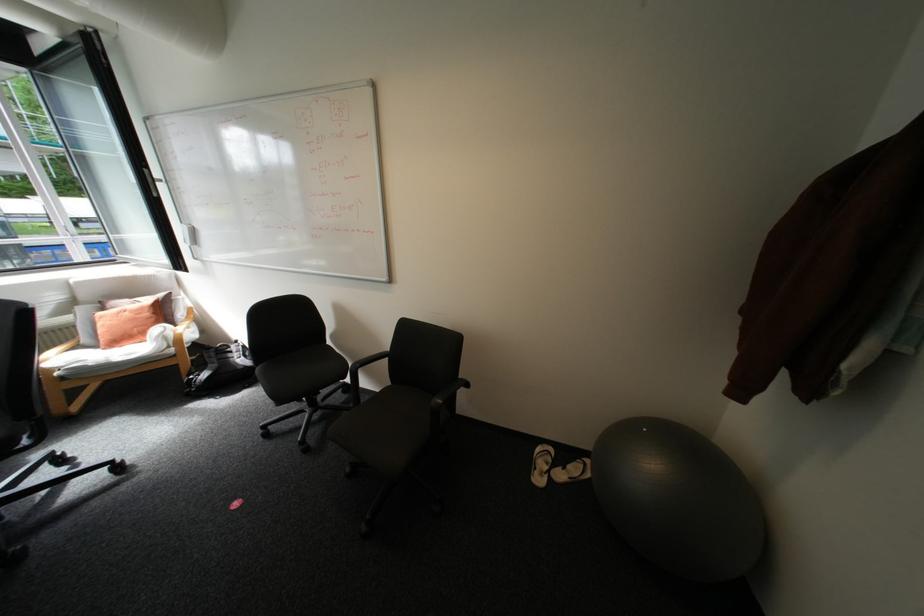
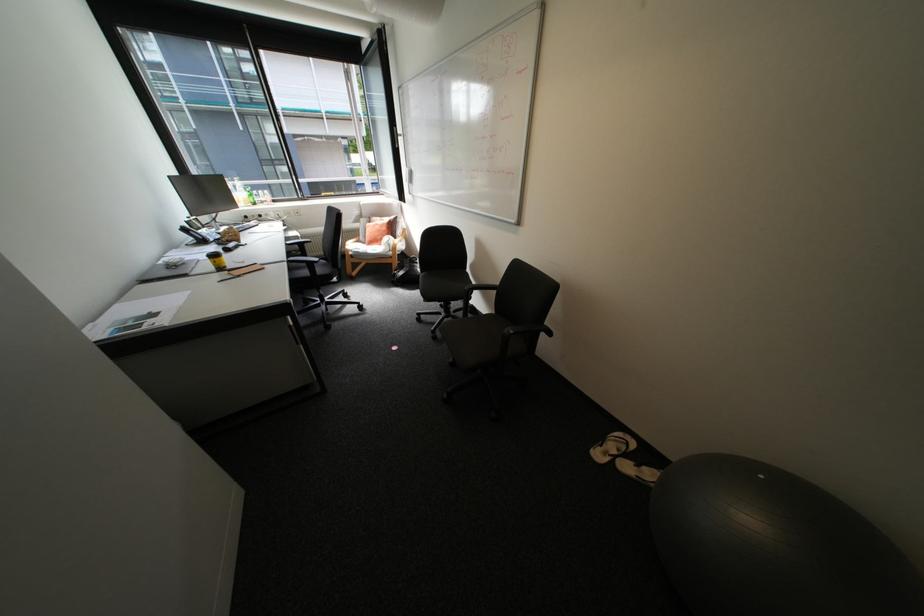
In the second image, find the point that corresponds to point 172,330 in the first image.

(397, 238)